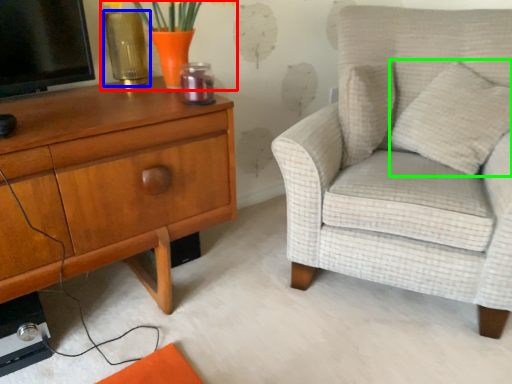
Question: Considering the real-world distances, which object is closest to floral arrangement (highlighted by a red box)? vase (highlighted by a blue box) or pillow (highlighted by a green box).

Choices:
 (A) vase
 (B) pillow

Answer: (A)